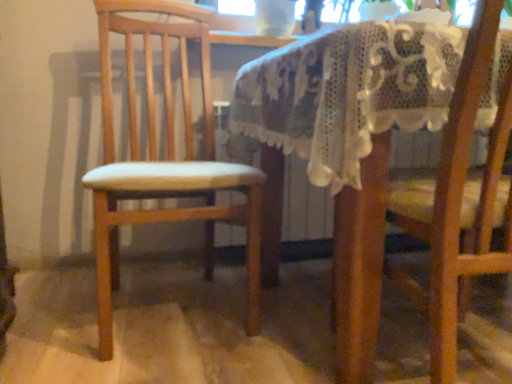
Find the location of a particular element. vacant position to the left of wooden chair at left, the 1th chair from the left is located at coordinates (55, 302).